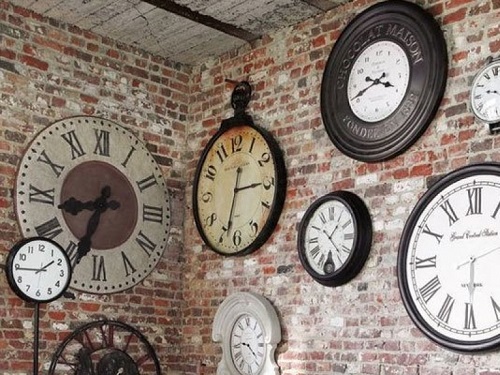
This screenshot has width=500, height=375. What are the coordinates of `clock` in the screenshot? It's located at (43, 270), (101, 213), (238, 186), (325, 233), (253, 349), (472, 261), (498, 95), (421, 84).